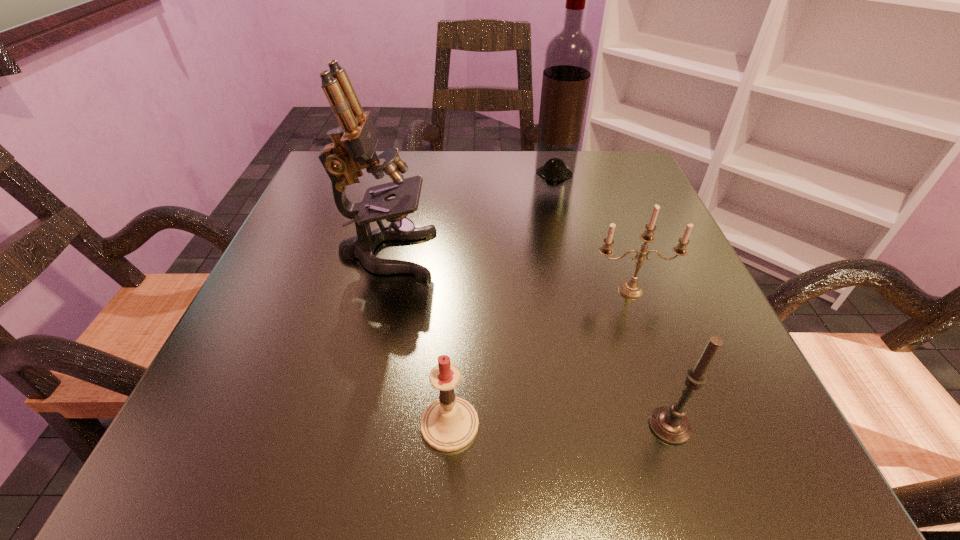
At what (x,y) coordinates should I click in order to perform the action: click on the closest candle to the fourth object from right to left. Please return your answer as a coordinate pair (x, y). Looking at the image, I should click on (669, 423).

Identify the location of free location that satisfies the following two spatial constraints: 1. at the eyepieces of the fourth nearest object; 2. on the right side of the shortest object. The width and height of the screenshot is (960, 540). (347, 424).

Find the location of a particular element. vacant area that satisfies the following two spatial constraints: 1. at the eyepieces of the second farthest object; 2. on the back side of the shortest candle is located at coordinates (347, 424).